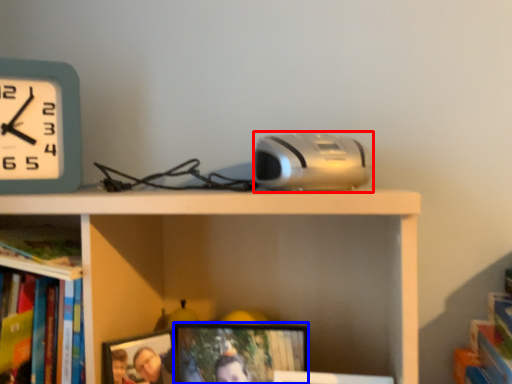
Question: Which of the following is the closest to the observer, gadget (highlighted by a red box) or picture frame (highlighted by a blue box)?

Choices:
 (A) gadget
 (B) picture frame

Answer: (A)